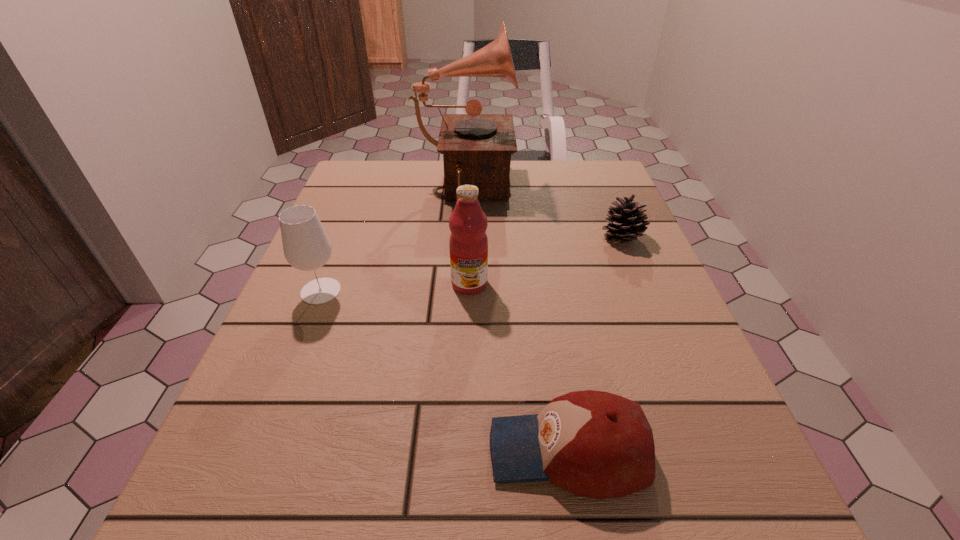
The image size is (960, 540). I want to click on free spot between the pinecone and the fourth shortest object, so click(545, 261).

Where is `vacant area between the fruit juice and the glass`? The width and height of the screenshot is (960, 540). vacant area between the fruit juice and the glass is located at coordinates (396, 287).

The height and width of the screenshot is (540, 960). Find the location of `empty space between the tallest object and the rightmost object`. empty space between the tallest object and the rightmost object is located at coordinates (542, 215).

Identify the location of free space between the fruit juice and the baseball cap. The image size is (960, 540). (519, 368).

I want to click on empty space between the baseball cap and the third tallest object, so click(444, 371).

Find the location of a particular element. The image size is (960, 540). empty space between the nearest object and the second tallest object is located at coordinates (519, 368).

Point out which object is positioned as the third nearest to the glass. Please provide its 2D coordinates. Your answer should be formatted as a tuple, i.e. [(x, y)], where the tuple contains the x and y coordinates of a point satisfying the conditions above.

[(595, 444)]

Where is `object that can be found as the second closest to the glass`? The width and height of the screenshot is (960, 540). object that can be found as the second closest to the glass is located at coordinates (468, 243).

Where is `vacant point that satisfies the following two spatial constraints: 1. on the horn of the record player; 2. on the back side of the rightmost object`? This screenshot has height=540, width=960. vacant point that satisfies the following two spatial constraints: 1. on the horn of the record player; 2. on the back side of the rightmost object is located at coordinates (462, 238).

You are a GUI agent. You are given a task and a screenshot of the screen. Output one action in this format:
    pyautogui.click(x=<x>, y=<y>)
    Task: Click on the free space that satisfies the following two spatial constraints: 1. on the horn of the rightmost object; 2. on the right side of the record player
    
    Given the screenshot: What is the action you would take?
    pyautogui.click(x=462, y=238)